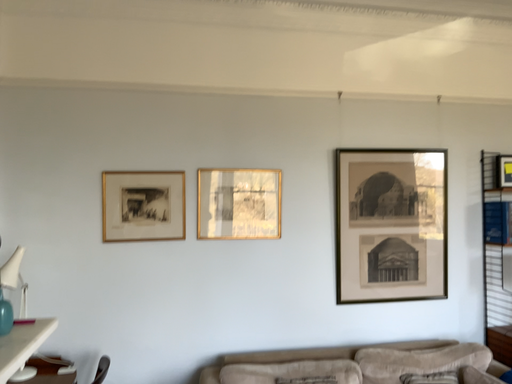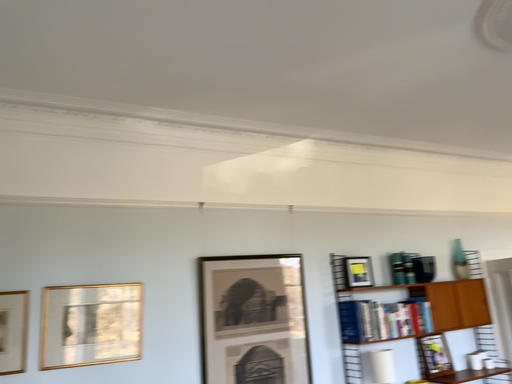
Question: Which way did the camera rotate in the video?

Choices:
 (A) rotated right
 (B) rotated left

Answer: (A)